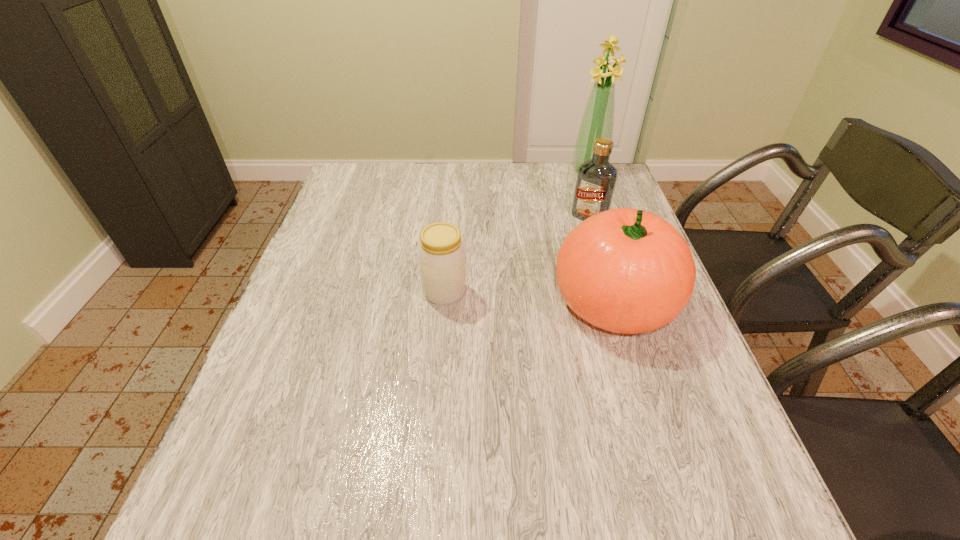
Image resolution: width=960 pixels, height=540 pixels. What are the coordinates of `vacant space at the near edge` in the screenshot? It's located at (591, 431).

Locate an element on the screen. This screenshot has height=540, width=960. vacant space at the left edge of the desktop is located at coordinates (368, 254).

You are a GUI agent. You are given a task and a screenshot of the screen. Output one action in this format:
    pyautogui.click(x=<x>, y=<y>)
    Task: Click on the vacant space at the right edge of the desktop
    The image size is (960, 540).
    Given the screenshot: What is the action you would take?
    pyautogui.click(x=650, y=377)

I want to click on free space at the far left corner of the desktop, so click(x=370, y=175).

Locate an element on the screen. This screenshot has height=540, width=960. free spot between the jar and the tallest object is located at coordinates (516, 232).

Locate an element on the screen. The image size is (960, 540). vacant point located between the vodka and the shortest object is located at coordinates coord(516,254).

In order to click on free spot between the leftmost object and the second farthest object in this screenshot , I will do 516,254.

The height and width of the screenshot is (540, 960). I want to click on vacant area between the shortest object and the farthest object, so click(516, 232).

The height and width of the screenshot is (540, 960). Find the location of `vacant space that's between the leftmost object and the pumpkin`. vacant space that's between the leftmost object and the pumpkin is located at coordinates (530, 296).

Identify the location of object that can be found as the closest to the leftmost object. Image resolution: width=960 pixels, height=540 pixels. (624, 270).